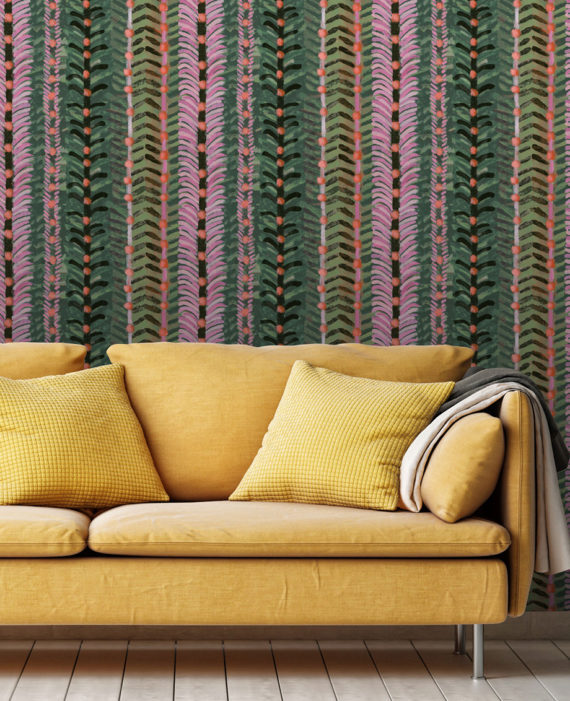
In order to click on couch cushions in this screenshot , I will do `click(169, 519)`, `click(59, 524)`, `click(177, 376)`, `click(35, 366)`.